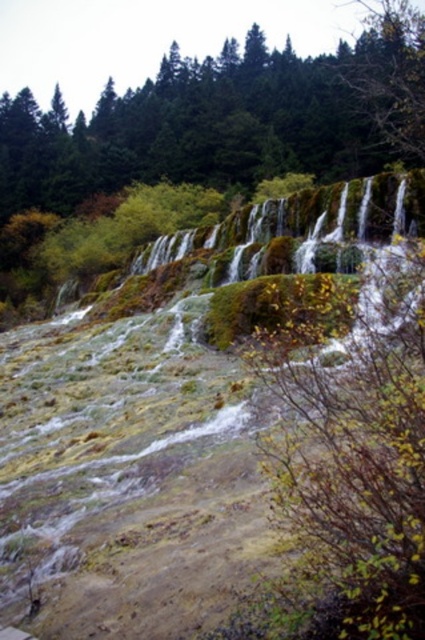
Which is above, green mossy hillside at center or green mossy rock at center?

Positioned higher is green mossy rock at center.

Who is more forward, (297, 364) or (360, 72)?

Point (297, 364) is more forward.

Between point (416, 472) and point (13, 188), which one is positioned behind?

The point (13, 188) is behind.

Find the location of a particular element. The image size is (425, 640). green mossy hillside at center is located at coordinates (217, 444).